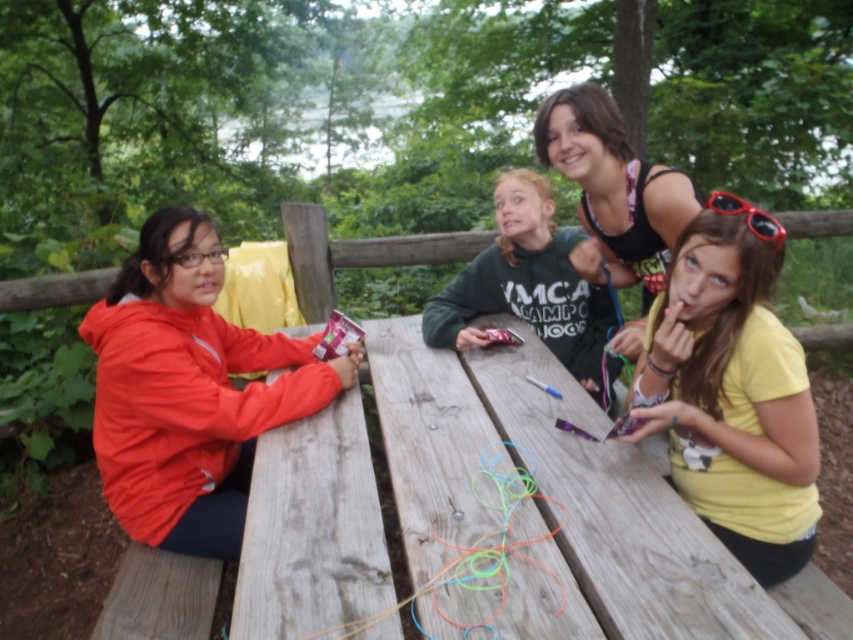
Looking at this image, who is more forward, (734, 596) or (190, 493)?

Positioned in front is point (734, 596).

Can you confirm if wooden picnic table at center is positioned below matte orange jacket at left?

Yes, wooden picnic table at center is below matte orange jacket at left.

Who is more forward, (x=662, y=580) or (x=103, y=312)?

Point (x=662, y=580)

Where is `wooden picnic table at center`? The width and height of the screenshot is (853, 640). wooden picnic table at center is located at coordinates (560, 500).

Does matte orange jacket at left lie in front of matte black tank top at upper center?

Yes, it is in front of matte black tank top at upper center.

Who is higher up, matte orange jacket at left or matte black tank top at upper center?

matte black tank top at upper center is higher up.

Between point (125, 433) and point (677, 189), which one is positioned in front?

Positioned in front is point (125, 433).

At what (x,y) coordinates should I click in order to perform the action: click on matte orange jacket at left. Please return your answer as a coordinate pair (x, y). The height and width of the screenshot is (640, 853). Looking at the image, I should click on (189, 390).

Does wooden picnic table at center appear under yellow matte shirt at right?

Indeed, wooden picnic table at center is positioned under yellow matte shirt at right.

Is wooden picnic table at center smaller than yellow matte shirt at right?

No.

You are a GUI agent. You are given a task and a screenshot of the screen. Output one action in this format:
    pyautogui.click(x=<x>, y=<y>)
    Task: Click on the wooden picnic table at center
    Image resolution: width=853 pixels, height=640 pixels.
    Given the screenshot: What is the action you would take?
    pyautogui.click(x=560, y=500)